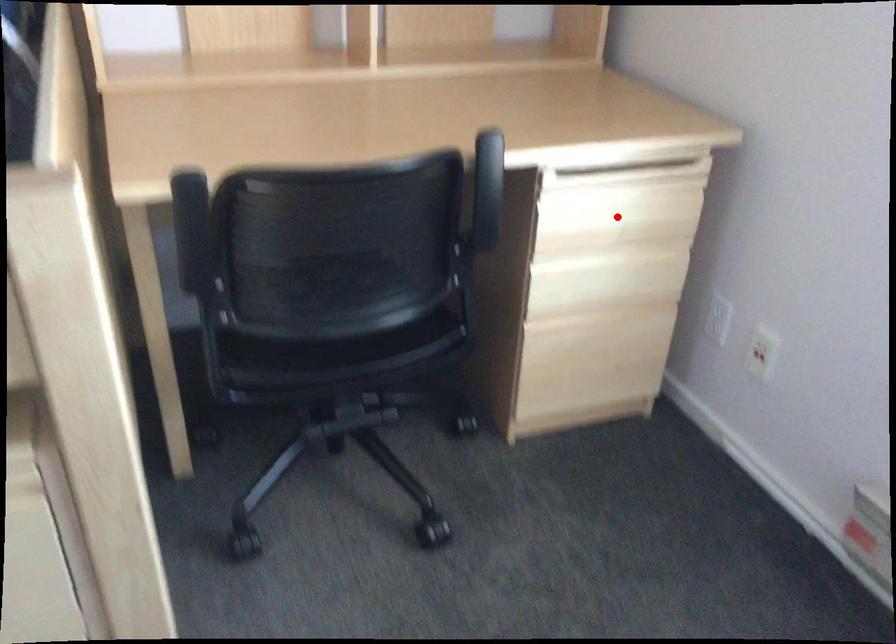
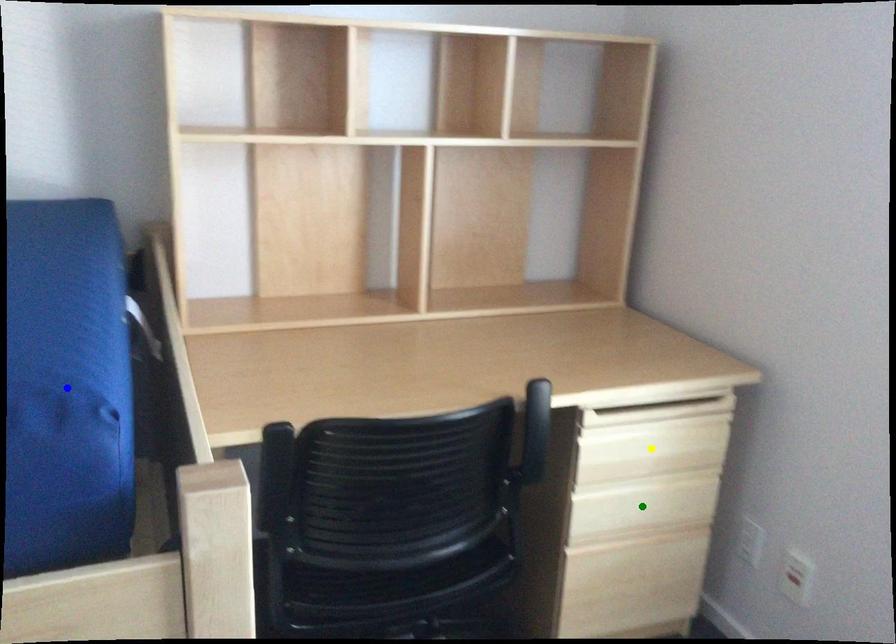
Question: I am providing you with two images of the same scene from different viewpoints. A red point is marked on the first image. You are given multiple points on the second image. Which mark in image 2 goes with the point in image 1?

Choices:
 (A) blue point
 (B) yellow point
 (C) green point

Answer: (B)